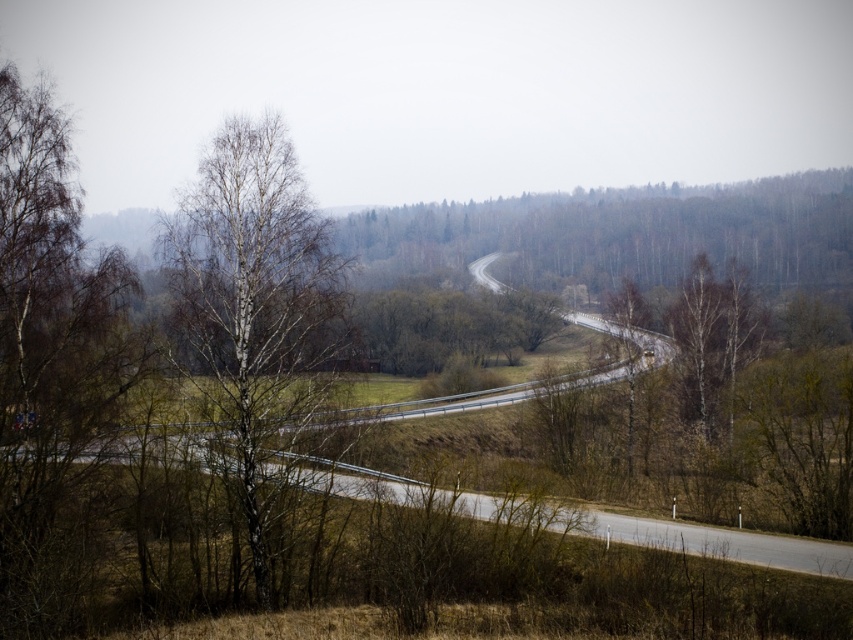
Question: Which of the following is the farthest from the observer?

Choices:
 (A) (265, 141)
 (B) (596, 531)

Answer: (B)

Question: Which of the following is the closest to the observer?

Choices:
 (A) (816, 547)
 (B) (167, 234)

Answer: (B)

Question: Is white bark tree at center above asphalt road at center?

Choices:
 (A) yes
 (B) no

Answer: (A)

Question: Is white bark tree at center thinner than asphalt road at center?

Choices:
 (A) no
 (B) yes

Answer: (B)

Question: Does white bark tree at center appear over asphalt road at center?

Choices:
 (A) no
 (B) yes

Answer: (B)